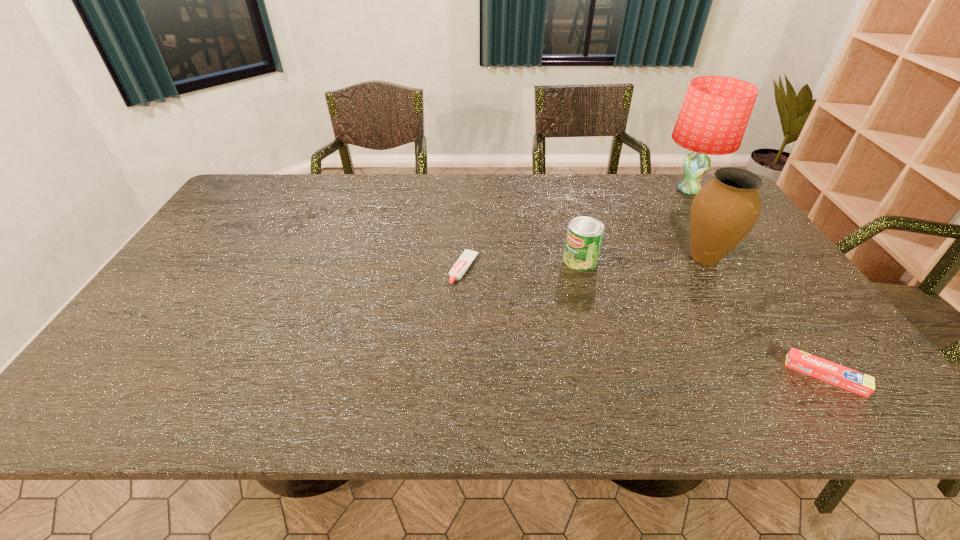
Locate an element on the screen. This screenshot has height=540, width=960. free spot between the third shortest object and the farthest object is located at coordinates (634, 225).

Locate an element on the screen. The image size is (960, 540). free area in between the nearest object and the left toothpaste is located at coordinates (645, 322).

Image resolution: width=960 pixels, height=540 pixels. In order to click on free point between the nearest object and the farthest object in this screenshot , I will do `click(756, 283)`.

Find the location of a particular element. This screenshot has height=540, width=960. object that stands as the third closest to the farther toothpaste is located at coordinates (714, 115).

The image size is (960, 540). Identify the location of object identified as the second closest to the nearest object. (584, 238).

The height and width of the screenshot is (540, 960). I want to click on vacant space that satisfies the following two spatial constraints: 1. on the front-facing side of the tallest object; 2. on the back side of the nearer toothpaste, so click(811, 375).

At what (x,y) coordinates should I click in order to perform the action: click on vacant space that satisfies the following two spatial constraints: 1. on the front-facing side of the farthest object; 2. on the front side of the farther toothpaste. Please return your answer as a coordinate pair (x, y). Looking at the image, I should click on click(740, 269).